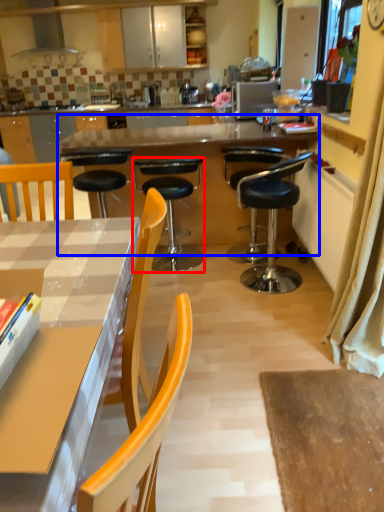
Question: Which object is closer to the camera taking this photo, chair (highlighted by a red box) or round table (highlighted by a blue box)?

Choices:
 (A) chair
 (B) round table

Answer: (A)